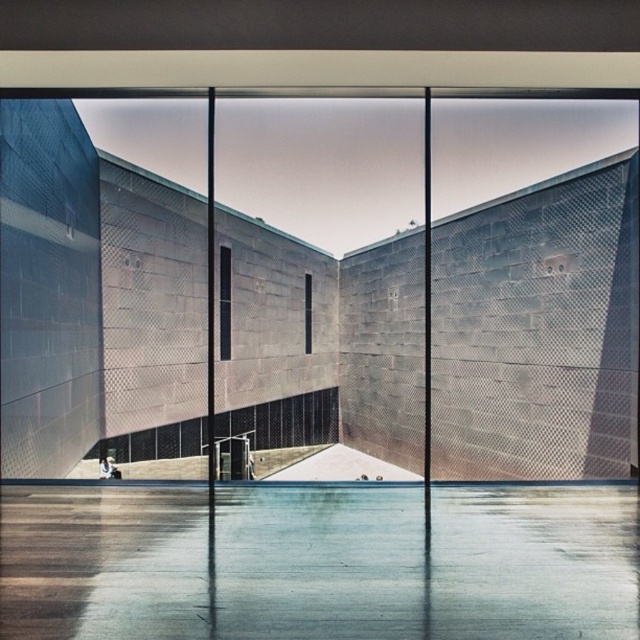
You are standing in the modern architectural structure described. You want to exit through the transparent glass door at center. According to the coordinates provided, in which direction should you walk to reach it?

The transparent glass door at center is located at coordinates point (532, 289). Since you are standing in the structure, you should walk forward towards the center area to reach the transparent glass door at center.

You are standing at point [532,289] in the modern architectural structure. What object is located exactly at your current position?

At point [532,289] lies transparent glass door at center.